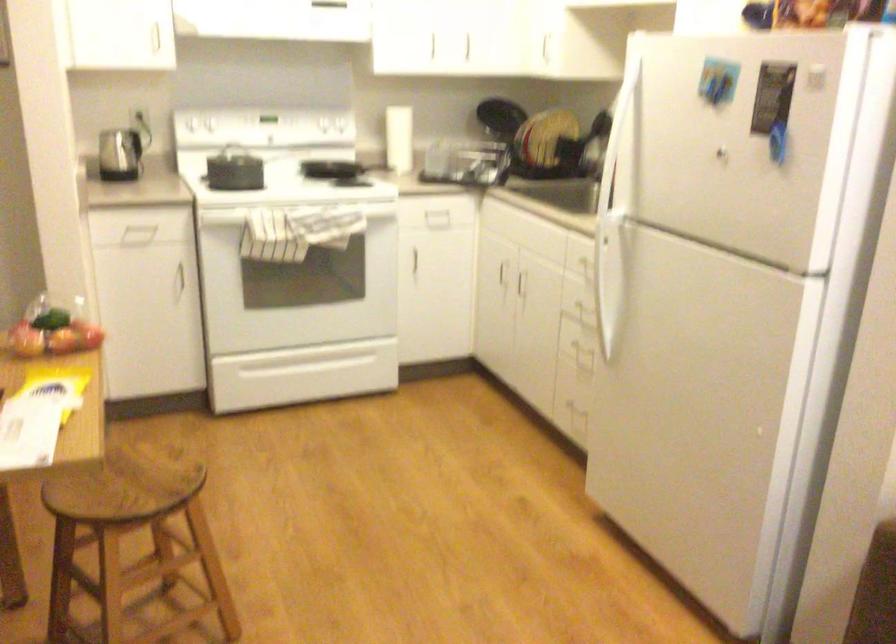
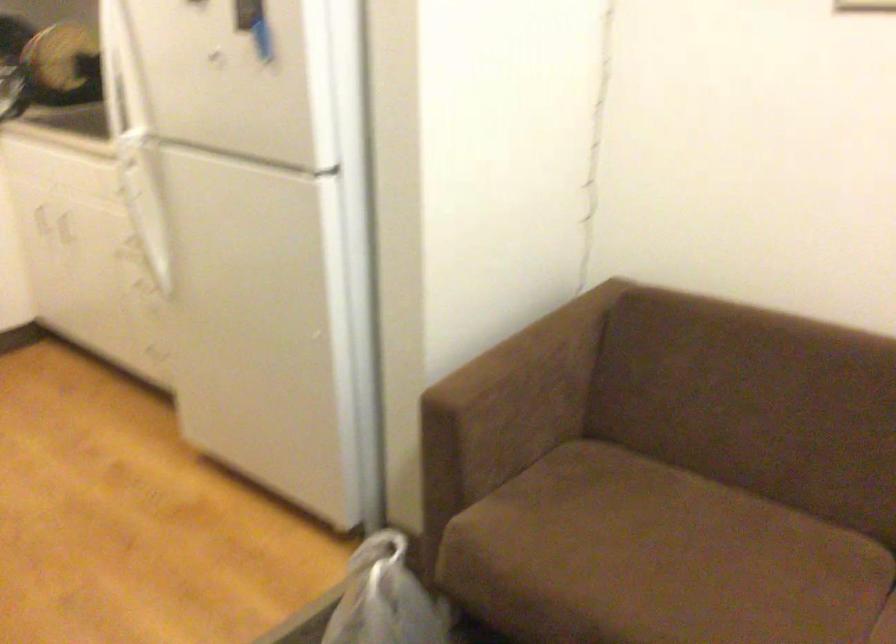
Question: The camera is either moving clockwise (left) or counter-clockwise (right) around the object. The first image is from the beginning of the video and the second image is from the end. Is the camera moving left or right when shooting the video?

Choices:
 (A) Left
 (B) Right

Answer: (A)